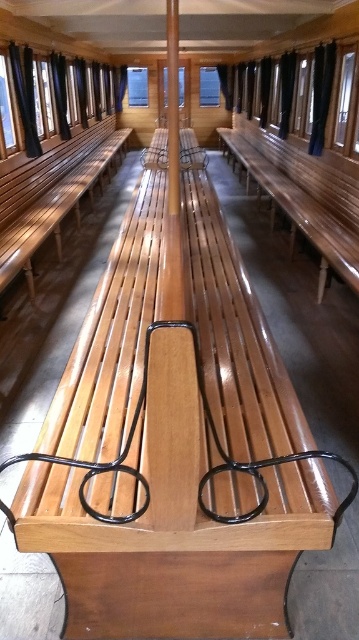
Question: Is shiny brown wood bench at left bigger than wooden bench at center?

Choices:
 (A) yes
 (B) no

Answer: (A)

Question: Can you confirm if glossy wood bench at center is bigger than shiny brown wood bench at left?

Choices:
 (A) no
 (B) yes

Answer: (A)

Question: Does glossy wood bench at center appear over wooden bench at center?

Choices:
 (A) yes
 (B) no

Answer: (B)

Question: Which object is farther from the camera taking this photo?

Choices:
 (A) wooden bench at center
 (B) shiny brown wood bench at left

Answer: (A)

Question: Which object is positioned closest to the wooden bench at center?

Choices:
 (A) glossy wood bench at center
 (B) shiny brown wood bench at left

Answer: (A)

Question: Which point is farther to the camera?

Choices:
 (A) (16, 186)
 (B) (190, 168)
 (C) (333, 227)

Answer: (B)